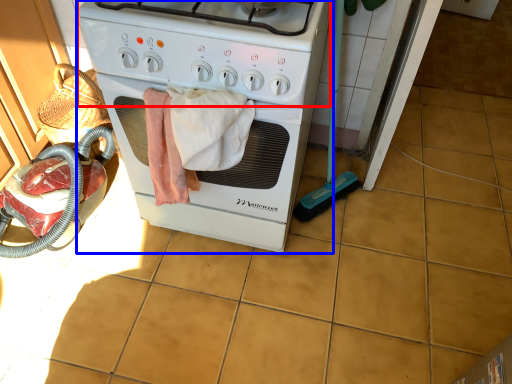
Question: Which object is closer to the camera taking this photo, gas stove (highlighted by a red box) or home appliance (highlighted by a blue box)?

Choices:
 (A) gas stove
 (B) home appliance

Answer: (A)